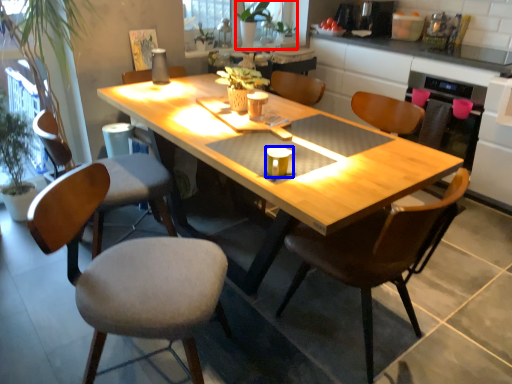
Question: Which object is further to the camera taking this photo, houseplant (highlighted by a red box) or coffee cup (highlighted by a blue box)?

Choices:
 (A) houseplant
 (B) coffee cup

Answer: (A)